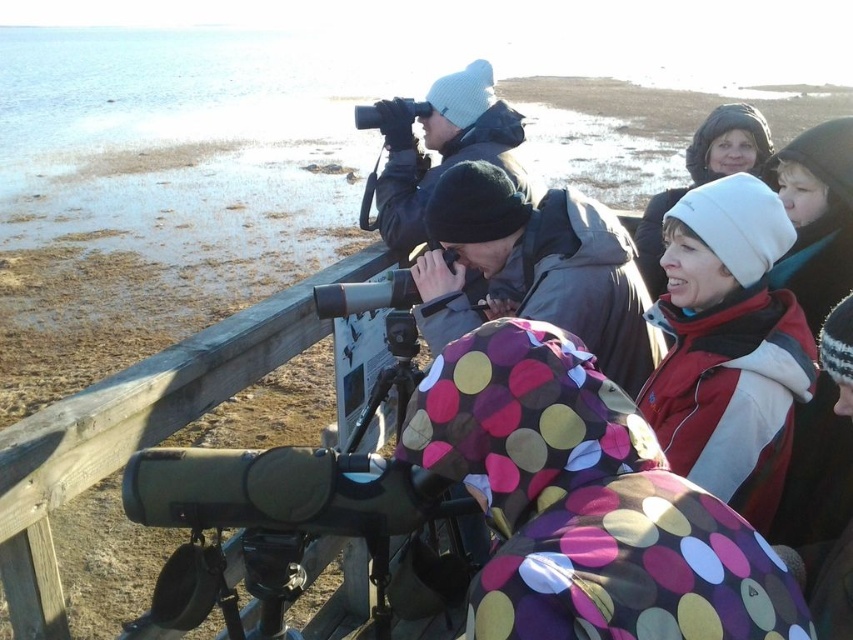
You are a photographer trying to capture a clear shot of the distant landscape through the telescope. However, two hats are blocking your view. Which hat is closer to the telescope, the white knit hat at upper right or the white fleece hat at upper center?

The white knit hat at upper right is positioned under the white fleece hat at upper center, meaning the white fleece hat at upper center is closer to the telescope.